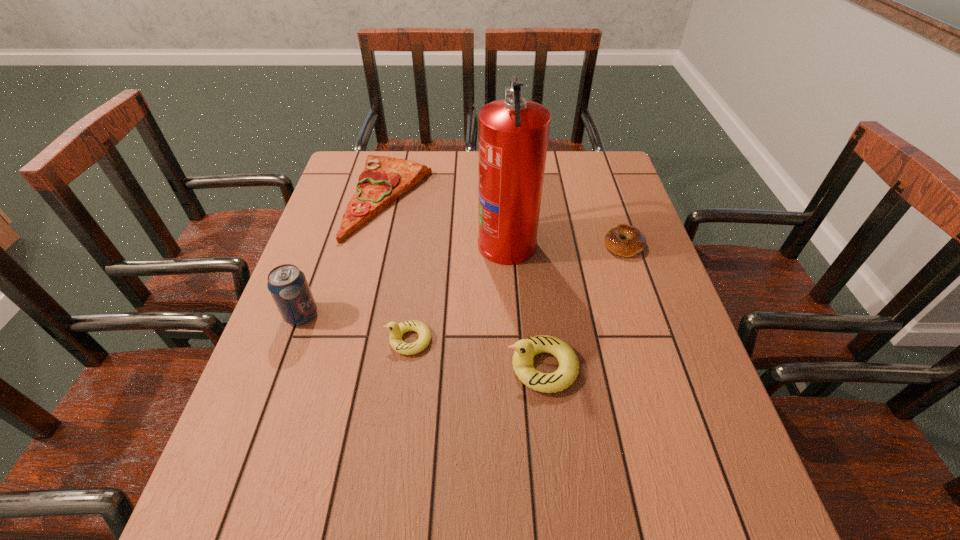
Locate which object ranks fourth in proximity to the fire extinguisher. Please provide its 2D coordinates. Your answer should be formatted as a tuple, i.e. [(x, y)], where the tuple contains the x and y coordinates of a point satisfying the conditions above.

[(525, 349)]

I want to click on the second closest object to the second tallest object, so click(x=383, y=180).

The image size is (960, 540). I want to click on free space that satisfies the following two spatial constraints: 1. on the front side of the bagel; 2. on the face of the taller duckling, so click(x=666, y=367).

You are a GUI agent. You are given a task and a screenshot of the screen. Output one action in this format:
    pyautogui.click(x=<x>, y=<y>)
    Task: Click on the free space that satisfies the following two spatial constraints: 1. on the instruction side of the tallest object; 2. on the back side of the bagel
    The width and height of the screenshot is (960, 540).
    Given the screenshot: What is the action you would take?
    pyautogui.click(x=507, y=243)

Find the location of `free space that satisfies the following two spatial constraints: 1. on the front side of the shortest object; 2. on the right side of the pizza`. free space that satisfies the following two spatial constraints: 1. on the front side of the shortest object; 2. on the right side of the pizza is located at coordinates (379, 243).